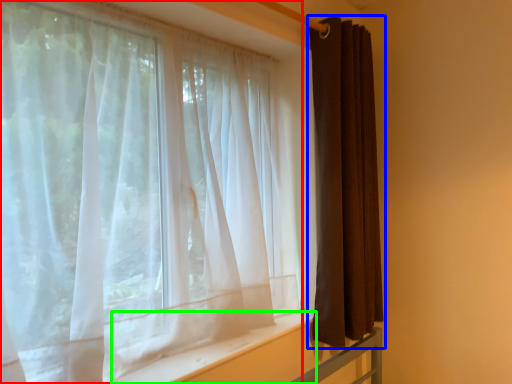
Question: Considering the real-world distances, which object is farthest from curtain (highlighted by a red box)? curtain (highlighted by a blue box) or window sill (highlighted by a green box)?

Choices:
 (A) curtain
 (B) window sill

Answer: (A)